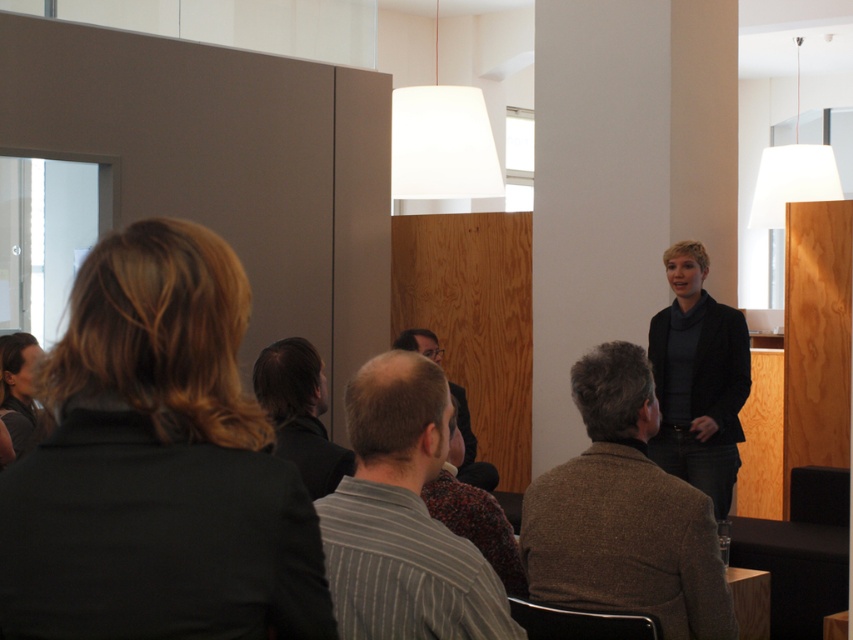
Question: Considering the relative positions of black matte jacket at lower left and dark gray sweater at center in the image provided, where is black matte jacket at lower left located with respect to dark gray sweater at center?

Choices:
 (A) below
 (B) above

Answer: (B)

Question: Considering the real-world distances, which object is closest to the brown woolen sweater at center?

Choices:
 (A) black matte jacket at lower left
 (B) striped fabric shirt at center
 (C) dark brown hair at center
 (D) striped cotton shirt at center

Answer: (D)

Question: Considering the real-world distances, which object is closest to the striped cotton shirt at center?

Choices:
 (A) brown woolen sweater at center
 (B) black matte jacket at lower left
 (C) dark brown hair at center
 (D) dark gray sweater at center

Answer: (A)

Question: Can you confirm if dark gray sweater at center is thinner than striped fabric shirt at center?

Choices:
 (A) no
 (B) yes

Answer: (B)

Question: Among these points, which one is nearest to the camera?

Choices:
 (A) (4, 337)
 (B) (288, 348)

Answer: (B)

Question: Does brown woolen sweater at center appear on the left side of matte black jacket at lower left?

Choices:
 (A) yes
 (B) no

Answer: (B)